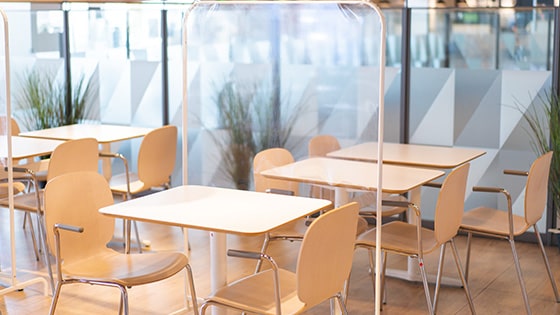
Find the location of `light brown seats`. light brown seats is located at coordinates (8, 134), (3, 189), (71, 153), (172, 147), (93, 204), (293, 279), (421, 239), (529, 202), (332, 149), (281, 162).